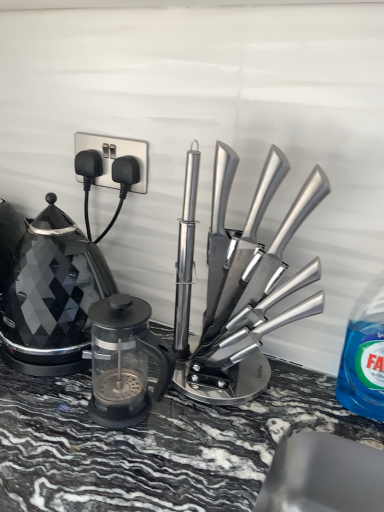
Question: Is polished stainless steel knife block at center, positioned as the second kitchen appliance in left-to-right order, positioned before blue translucent liquid at right?

Choices:
 (A) no
 (B) yes

Answer: (B)

Question: Is the depth of polished stainless steel knife block at center, the first kitchen appliance in the right-to-left sequence, greater than that of blue translucent liquid at right?

Choices:
 (A) no
 (B) yes

Answer: (A)

Question: From the image's perspective, is polished stainless steel knife block at center, positioned as the second kitchen appliance in left-to-right order, below blue translucent liquid at right?

Choices:
 (A) no
 (B) yes

Answer: (A)

Question: Does polished stainless steel knife block at center, positioned as the second kitchen appliance in left-to-right order, have a smaller size compared to blue translucent liquid at right?

Choices:
 (A) no
 (B) yes

Answer: (A)

Question: From the image's perspective, is polished stainless steel knife block at center, the first kitchen appliance in the right-to-left sequence, on top of blue translucent liquid at right?

Choices:
 (A) no
 (B) yes

Answer: (B)

Question: Is polished stainless steel knife block at center, positioned as the second kitchen appliance in left-to-right order, facing away from blue translucent liquid at right?

Choices:
 (A) no
 (B) yes

Answer: (A)

Question: Is black glass kettle at left turned away from blue translucent liquid at right?

Choices:
 (A) no
 (B) yes

Answer: (A)

Question: Can you confirm if black glass kettle at left is shorter than blue translucent liquid at right?

Choices:
 (A) yes
 (B) no

Answer: (B)

Question: Does black glass kettle at left appear on the left side of blue translucent liquid at right?

Choices:
 (A) no
 (B) yes

Answer: (B)

Question: Would you say black glass kettle at left is outside blue translucent liquid at right?

Choices:
 (A) yes
 (B) no

Answer: (A)

Question: Considering the relative sizes of black glass kettle at left and blue translucent liquid at right in the image provided, is black glass kettle at left thinner than blue translucent liquid at right?

Choices:
 (A) no
 (B) yes

Answer: (A)

Question: Is black glass kettle at left oriented towards blue translucent liquid at right?

Choices:
 (A) yes
 (B) no

Answer: (B)

Question: Is transparent glass french press at center, acting as the first kitchen appliance starting from the left, far away from blue translucent liquid at right?

Choices:
 (A) no
 (B) yes

Answer: (A)